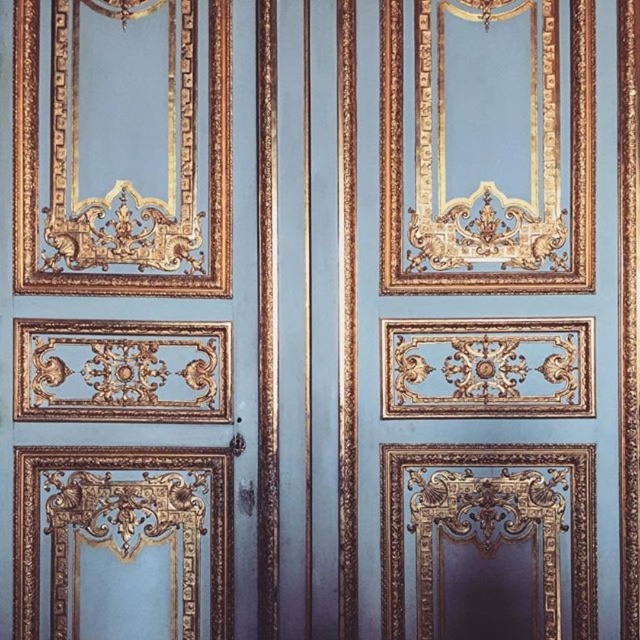
Who is positioned more to the right, gold metallic door at center or matte gold door at center?

gold metallic door at center

Does gold metallic door at center have a lesser width compared to matte gold door at center?

In fact, gold metallic door at center might be wider than matte gold door at center.

Which is behind, point (528, 621) or point (125, 374)?

The point (125, 374) is more distant.

Locate an element on the screen. The height and width of the screenshot is (640, 640). gold metallic door at center is located at coordinates (486, 317).